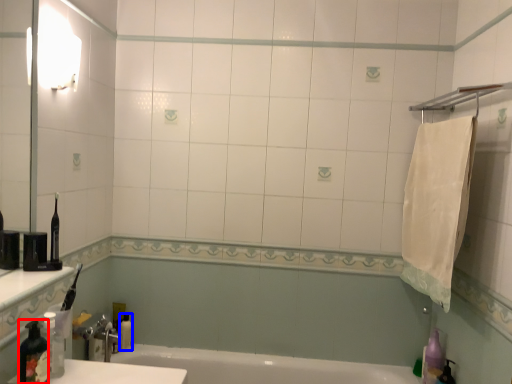
Question: Among these objects, which one is nearest to the camera, bottle (highlighted by a red box) or toiletry (highlighted by a blue box)?

Choices:
 (A) bottle
 (B) toiletry

Answer: (A)